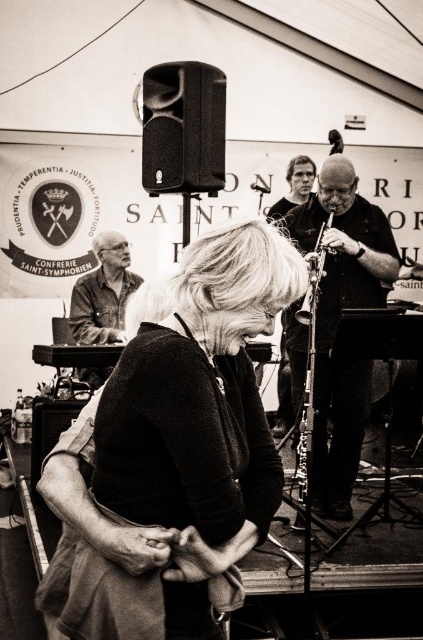
You are an event photographer at the festival. You need to capture a closeup shot of the smooth black clarinet at center and the matte black shirt at left. Since both are black, you want to adjust your camera settings to focus on their size difference. Which object should you focus on to ensure it appears larger in the photo?

The smooth black clarinet at center has a larger size compared to the matte black shirt at left, so focusing on the smooth black clarinet at center will make it appear larger in the photo.

You are at a music festival and want to take a photo of both the smooth black clarinet at center and the metallic silver flute at center. The camera you have can only focus on objects within a 6 inch range. Can you capture both instruments in one shot without moving the camera?

The smooth black clarinet at center and the metallic silver flute at center are 7.48 inches apart. Since the camera can only focus within a 6 inch range, the distance between them exceeds the camera range, so you cannot capture both in one shot without moving the camera.

You are a photographer at the event and want to capture both the smooth black clarinet at center and the metallic silver flute at center in one frame. Which instrument should you position to the right side of your camera frame to include both?

To include both the smooth black clarinet at center and the metallic silver flute at center in one frame, position the metallic silver flute at center on the right side of your camera frame since the smooth black clarinet at center is already to the right of it.